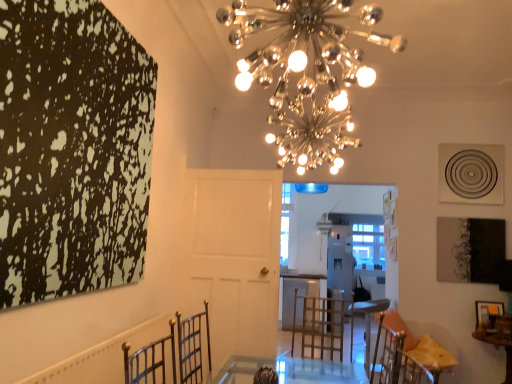
Question: Is wooden table at lower right inside or outside of metallic spherical lights at upper center?

Choices:
 (A) outside
 (B) inside

Answer: (A)

Question: Considering the positions of point (507, 352) and point (232, 44), is point (507, 352) closer or farther from the camera than point (232, 44)?

Choices:
 (A) farther
 (B) closer

Answer: (A)

Question: Which object is the farthest from the wooden picture frame at lower right?

Choices:
 (A) metallic gold chair at lower right
 (B) metallic spherical lights at upper center
 (C) wooden table at lower right

Answer: (B)

Question: Based on their relative distances, which object is nearer to the wooden table at lower right?

Choices:
 (A) metallic spherical lights at upper center
 (B) wooden picture frame at lower right
 (C) metallic gold chair at lower right

Answer: (B)